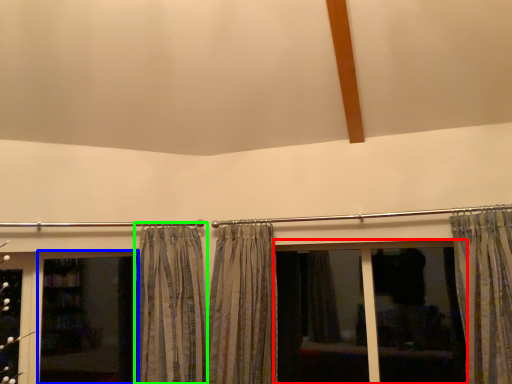
Question: Based on their relative distances, which object is farther from bay window (highlighted by a red box)? Choose from screen door (highlighted by a blue box) and curtain (highlighted by a green box).

Choices:
 (A) screen door
 (B) curtain

Answer: (A)